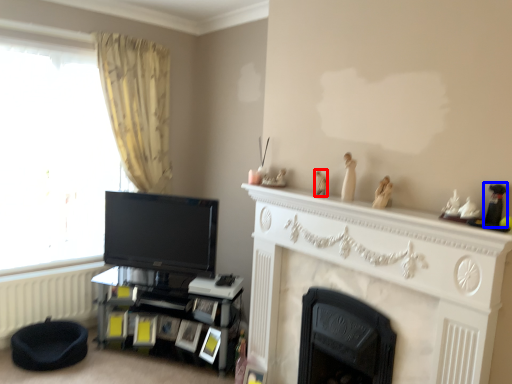
Question: Which point is closer to the camera, toy (highlighted by a red box) or toy (highlighted by a blue box)?

Choices:
 (A) toy
 (B) toy

Answer: (B)